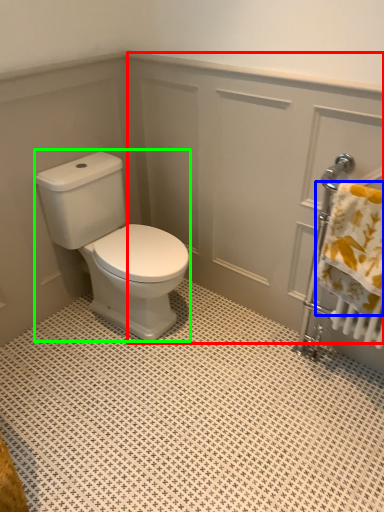
Question: Considering the real-world distances, which object is closest to screen door (highlighted by a red box)? bath towel (highlighted by a blue box) or porcelain (highlighted by a green box).

Choices:
 (A) bath towel
 (B) porcelain

Answer: (B)